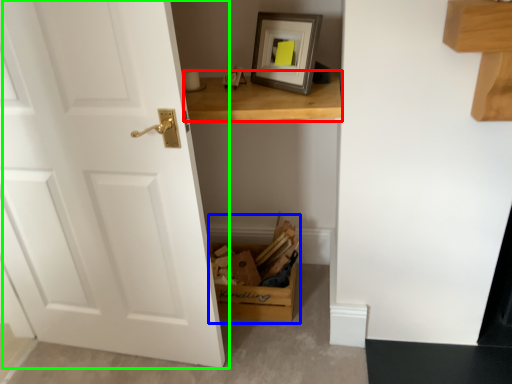
Question: Which object is positioned closest to table (highlighted by a red box)? Select from cardboard box (highlighted by a blue box) and door (highlighted by a green box).

Choices:
 (A) cardboard box
 (B) door

Answer: (B)